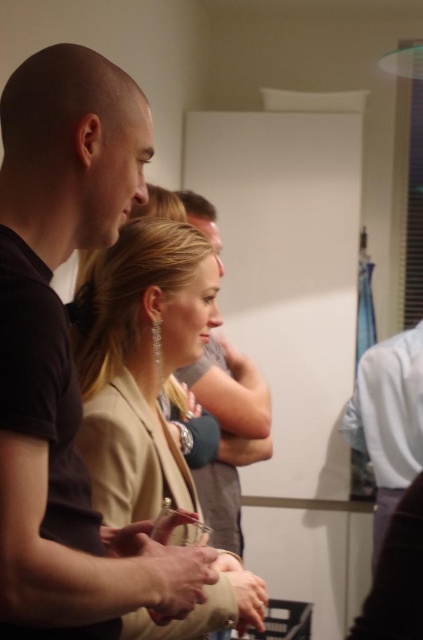
You are organizing a photoshoot and need to place a small accessory between the black matte shirt at left and the satin beige blazer at center. Based on their widths, which object should the accessory be placed closer to?

The black matte shirt at left is thinner than the satin beige blazer at center, so the accessory should be placed closer to the black matte shirt at left to balance their widths.

You are standing at the point marked as point (63, 474) in the image. You want to move forward 30 inches. Will you hit any object in the scene?

The distance of point (63, 474) from camera is 33.58 inches. Moving forward 30 inches would leave you 3.58 inches away from the nearest object, so you won

You are standing in the room and want to move from the point at coordinates (41,465) to the point at (153,337). Which direction should you face to walk towards your destination?

You should face backward because point (41,465) is in front of point (153,337), so moving towards the destination requires facing away from the current position.